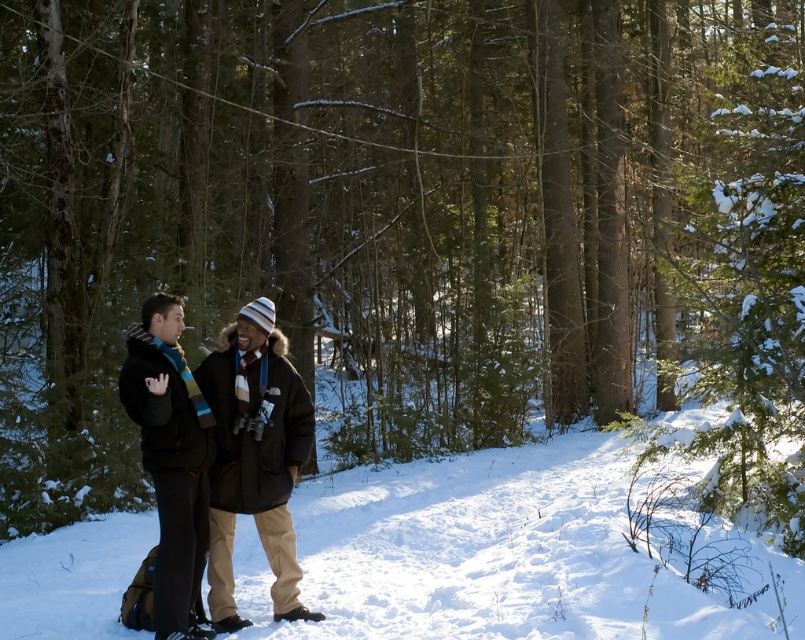
Question: Can you confirm if dark brown wool coat at center is bigger than knitted wool scarf at left?

Choices:
 (A) yes
 (B) no

Answer: (A)

Question: Which of the following is the farthest from the observer?

Choices:
 (A) (263, 376)
 (B) (141, 308)

Answer: (B)

Question: Does dark brown wool coat at center appear over knitted wool scarf at left?

Choices:
 (A) yes
 (B) no

Answer: (B)

Question: Does dark brown wool coat at center have a larger size compared to knitted wool scarf at left?

Choices:
 (A) yes
 (B) no

Answer: (A)